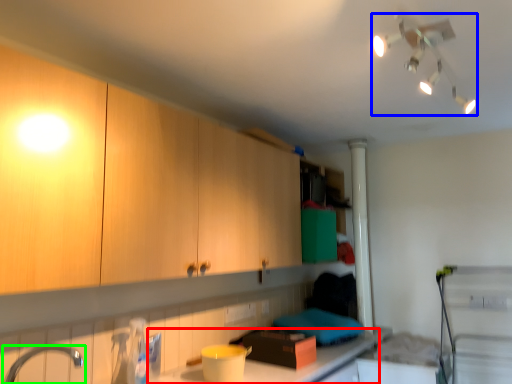
Question: Which is nearer to the countertop (highlighted by a red box)? light fixture (highlighted by a blue box) or tap (highlighted by a green box).

Choices:
 (A) light fixture
 (B) tap

Answer: (B)